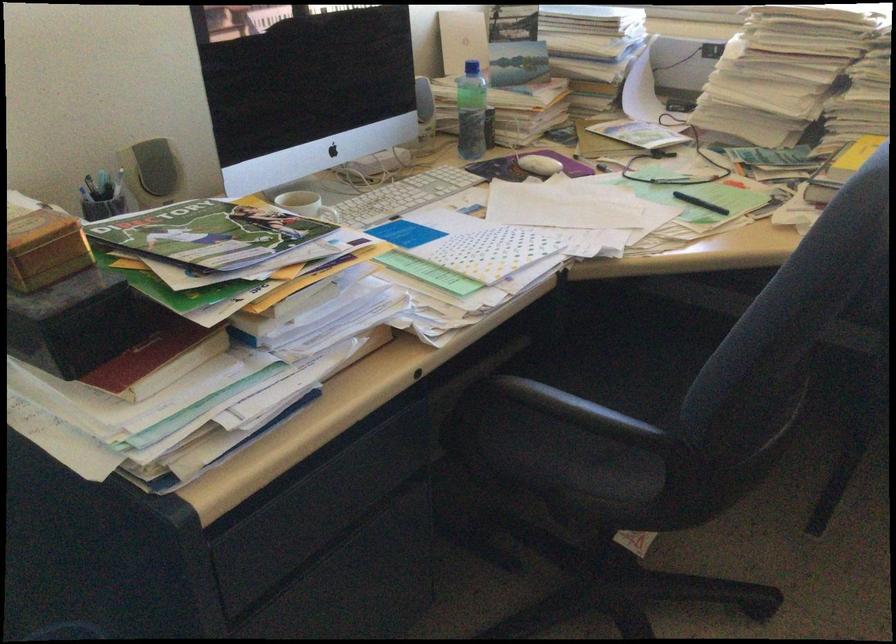
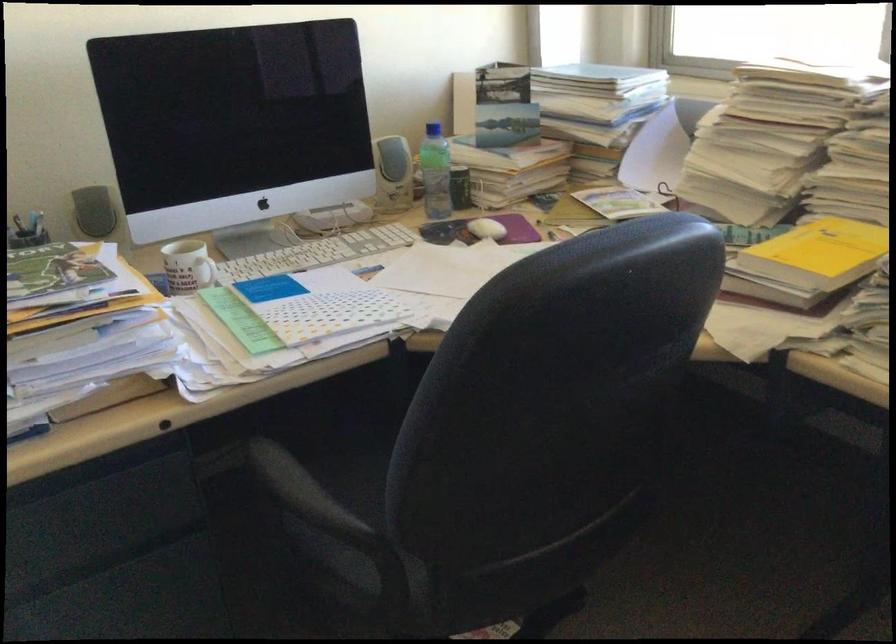
Question: Which direction would the cameraman need to move to produce the second image? Reply with the corresponding letter.

Choices:
 (A) Left
 (B) Right
 (C) Forward
 (D) Backward

Answer: (B)